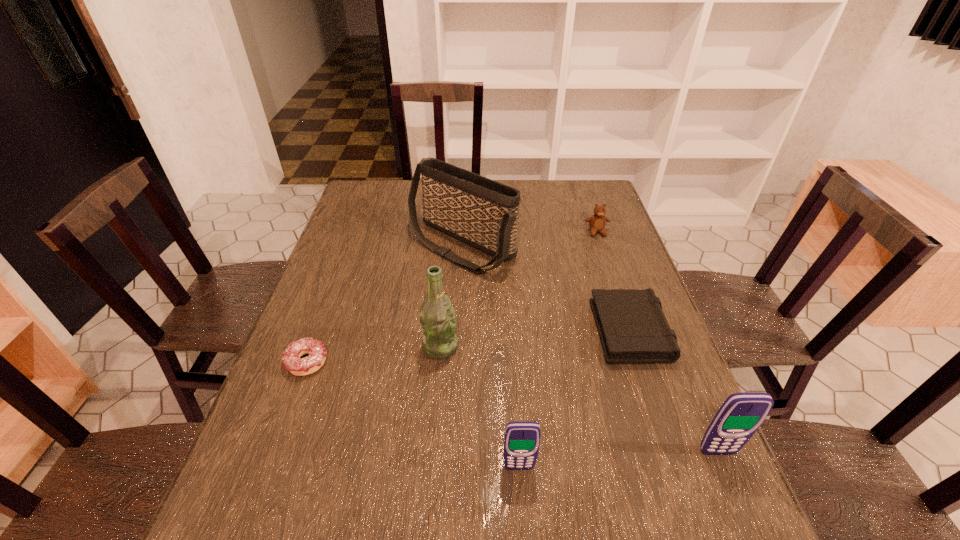
Considering the uniform spacing of cellular telephones, where should an additional cellular telephone be positioned on the left? Please locate a free spot. Please provide its 2D coordinates. Your answer should be formatted as a tuple, i.e. [(x, y)], where the tuple contains the x and y coordinates of a point satisfying the conditions above.

[(309, 484)]